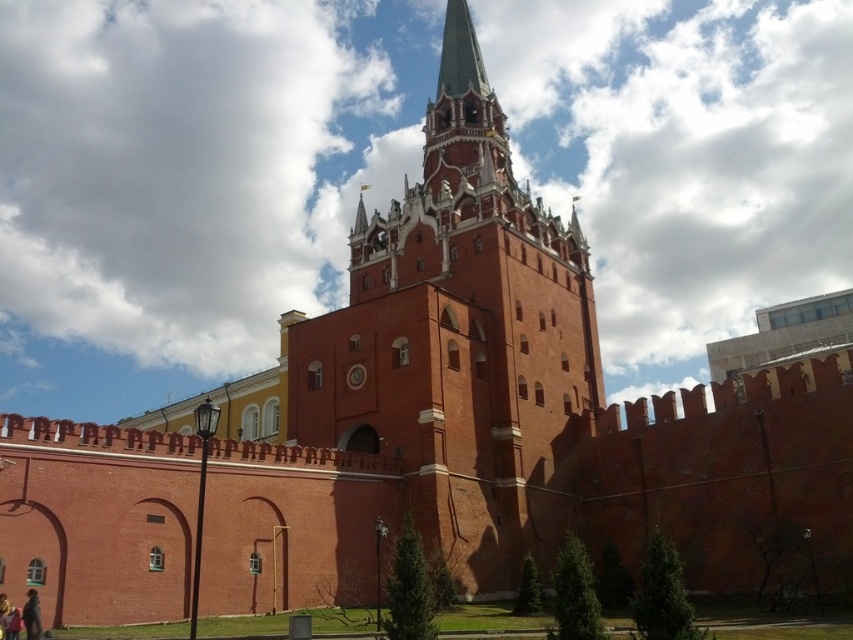
Question: Is red brick tower at center above dark brown leather jacket at lower left?

Choices:
 (A) yes
 (B) no

Answer: (A)

Question: Is red brick tower at center to the left of dark brown leather jacket at lower left from the viewer's perspective?

Choices:
 (A) no
 (B) yes

Answer: (A)

Question: Which of the following is the closest to the observer?

Choices:
 (A) dark brown leather jacket at lower left
 (B) red brick tower at center

Answer: (A)

Question: Where is red brick tower at center located in relation to dark brown leather jacket at lower left in the image?

Choices:
 (A) below
 (B) above

Answer: (B)

Question: Which of the following is the farthest from the observer?

Choices:
 (A) dark brown leather jacket at lower left
 (B) red brick tower at center

Answer: (B)

Question: Which of the following is the closest to the observer?

Choices:
 (A) (456, 216)
 (B) (22, 605)

Answer: (B)